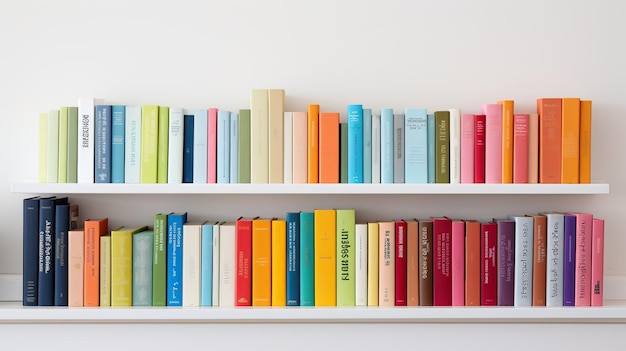
Locate an element on the screen. orange books is located at coordinates (90, 245), (316, 132), (326, 134), (265, 244), (587, 142), (572, 144), (510, 137).